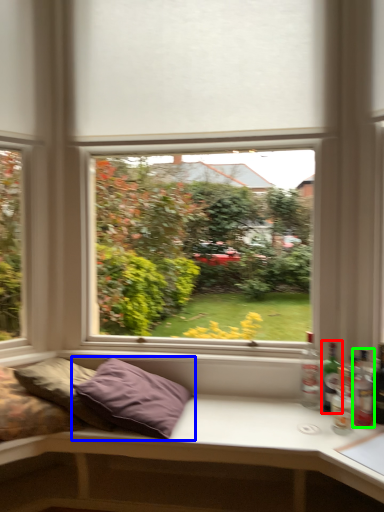
Question: Which is farther away from bottle (highlighted by a red box)? pillow (highlighted by a blue box) or bottle (highlighted by a green box)?

Choices:
 (A) pillow
 (B) bottle

Answer: (A)